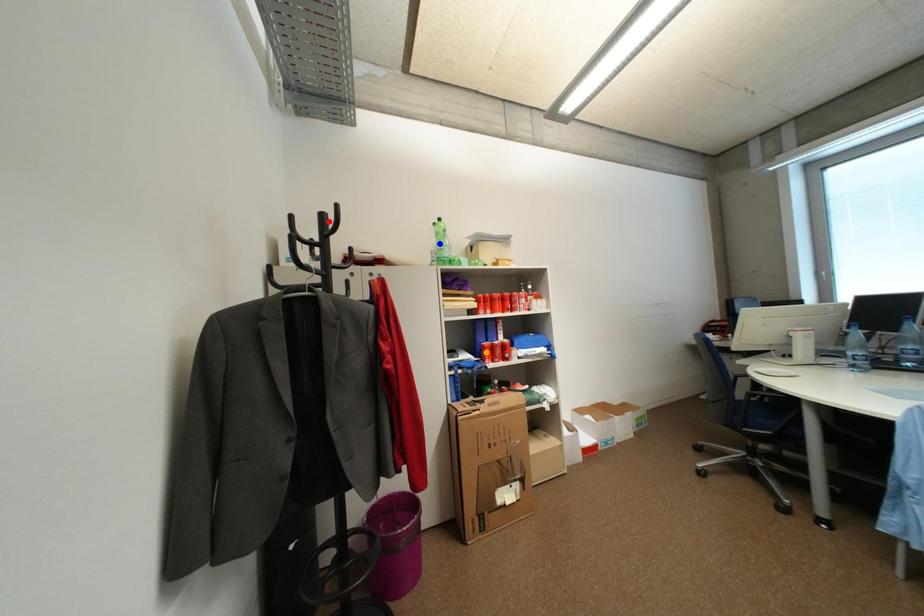
Order these from nearest to farthest:
orange point, red point, blue point

orange point, blue point, red point